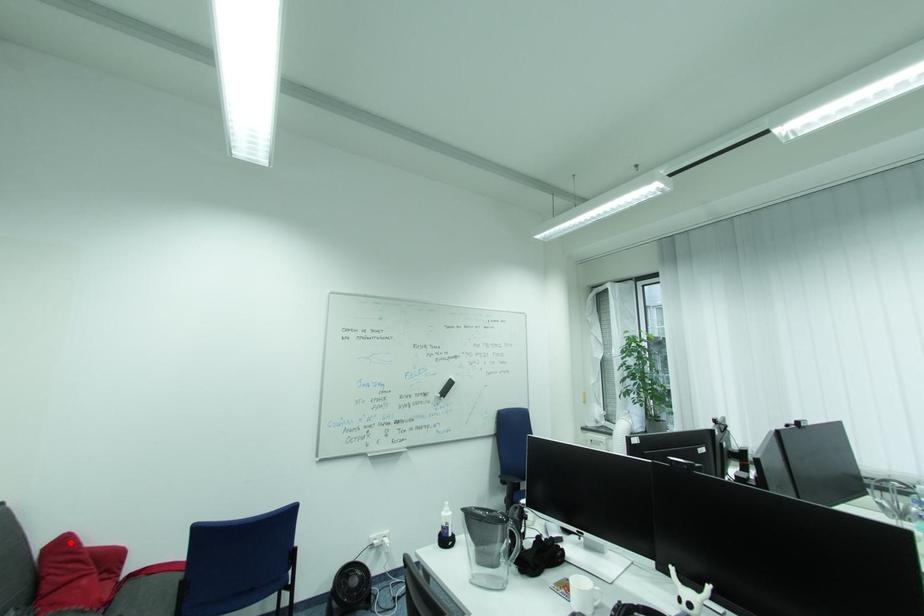
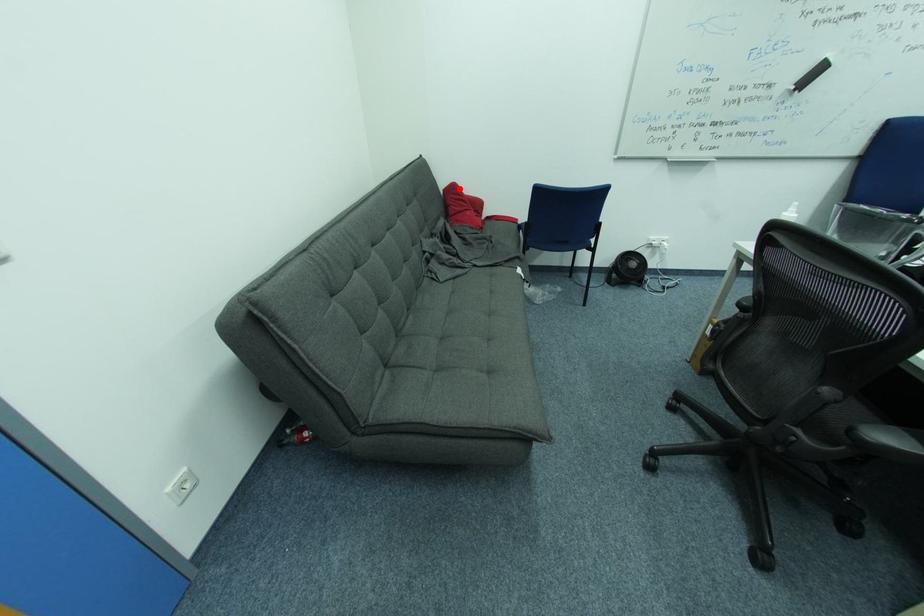
I am providing you with two images of the same scene from different viewpoints. A red point is marked on the first image and another point is marked on the second image. Are the points marked in image1 and image2 representing the same 3D position?

Yes